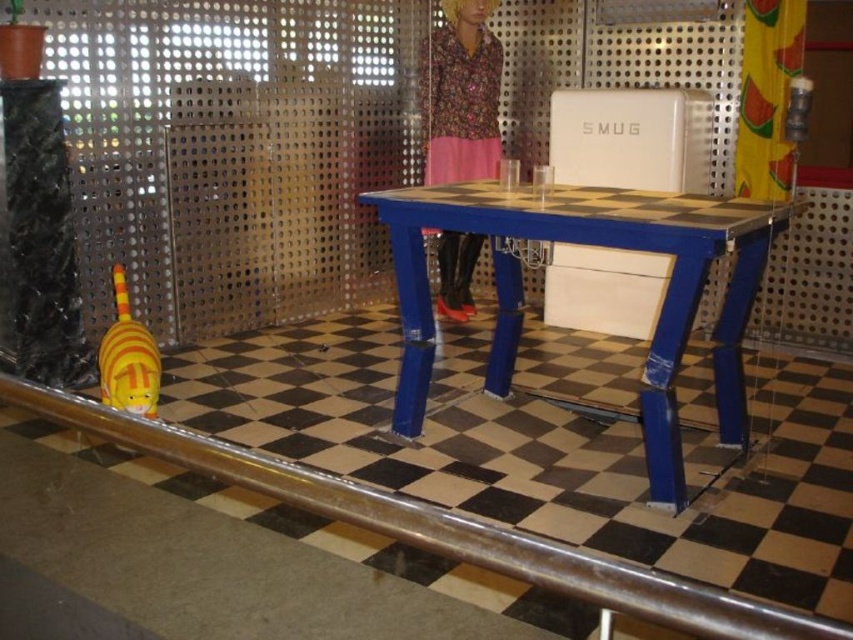
You are standing in the center of the room and want to place a new decorative item on the blue painted wood table at center. Given that the table is represented by the point at coordinates point (x=592, y=244), can you confirm the exact location where you should place the item to ensure it is centered on the table?

The blue painted wood table at center is represented by the point (x=592, y=244), so placing the item at those coordinates will center it on the table.

You are standing in the room described and see the point marked at coordinates (463, 96). What object is located at that point?

The point at coordinates (463, 96) marks the location of the floral fabric doll at center.